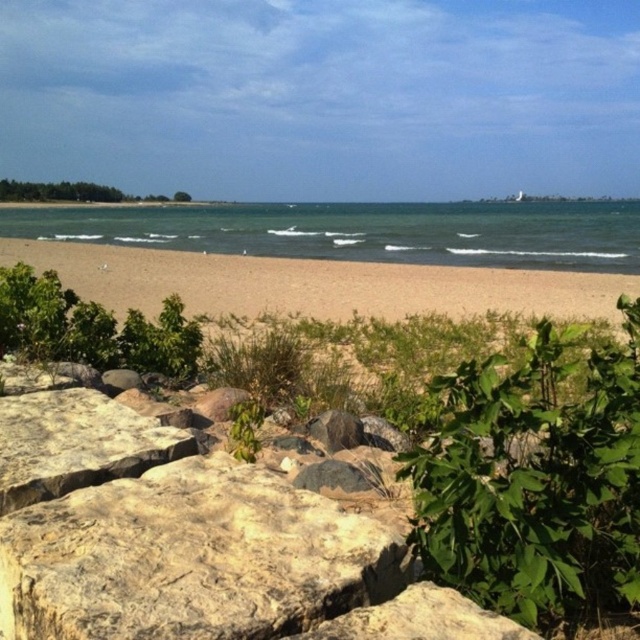
You are a hiker who wants to place a small backpack between the rough textured rock at lower left and the green leafy shrubs at left. Since the backpack is 1 meter wide, can it fit between them?

The rough textured rock at lower left is smaller than the green leafy shrubs at left. However, the exact distance between them isn not specified in the objects description. Therefore, it is unclear if the 1 meter wide backpack can fit between them.